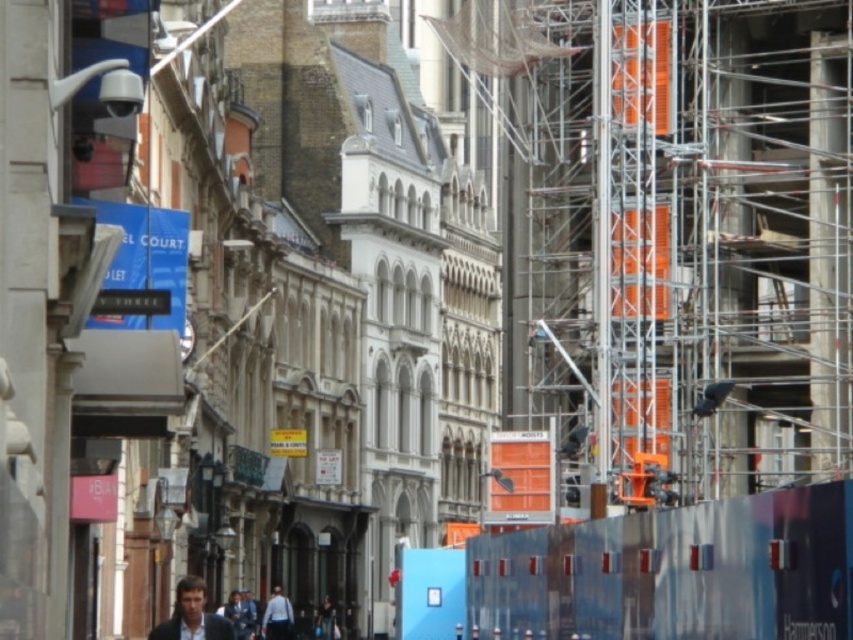
You are a photographer trying to capture a candid shot of the man in the light blue shirt at lower center. However, there is an obstruction from the light brown leather jacket at lower center. To get a clear shot, should you move to the left or right of your current position?

The light brown leather jacket at lower center is to the left of the light blue shirt at lower center. To avoid the obstruction, move to the right of your current position to get a clear shot of the light blue shirt at lower center.

You are a pedestrian standing at the point marked by the coordinates point [192,616]. Looking around, you see a light brown leather jacket at lower center. What is the nearest object to you in the scene?

The nearest object to you is the light brown leather jacket at lower center because you are standing at the coordinates point [192,616], which marks its location.

You are standing at a point in the city square and want to reach the historic buildings on the left side of the image. The point you are currently at is labeled as point [184,595]. Given that the distance between you and this point is 83.27 meters, can you estimate how far you need to walk to reach the historic buildings?

The distance between you and point [184,595] is 83.27 meters. However, the question is about reaching the historic buildings on the left side of the image. Since the provided information only specifies the distance to the point, not the buildings themselves, we cannot accurately determine the distance to the buildings based on the given data.